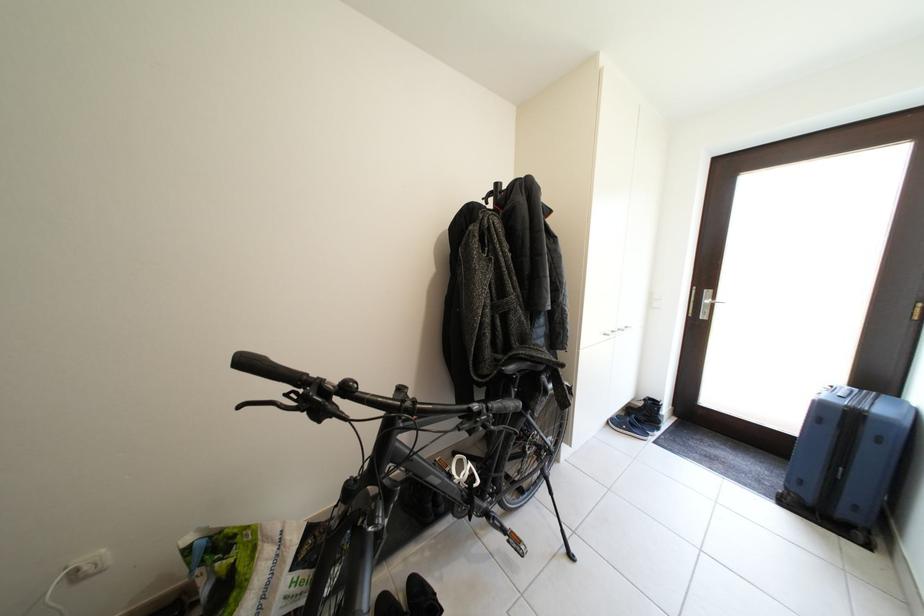
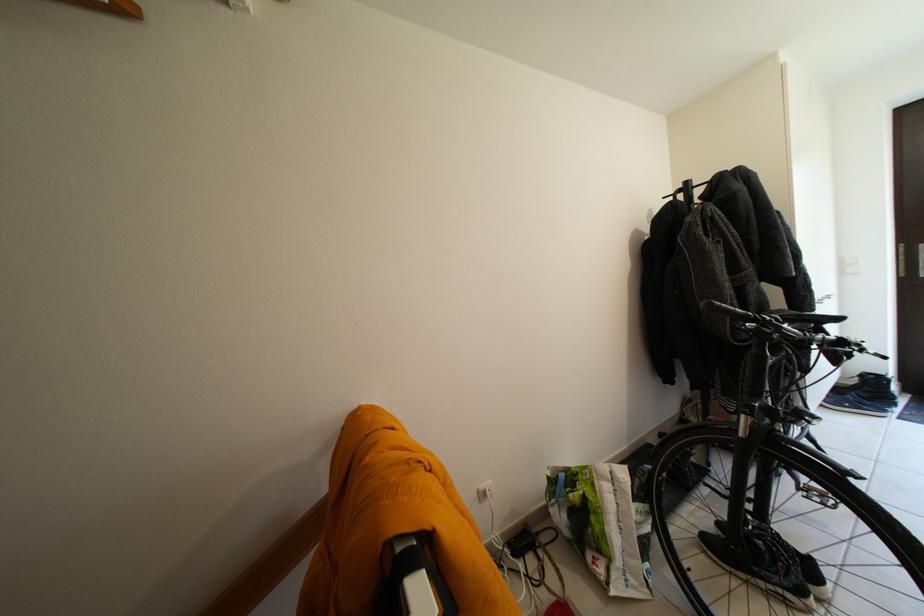
The images are taken continuously from a first-person perspective. In which direction are you moving?

The movement direction of the cameraman is left, backward.